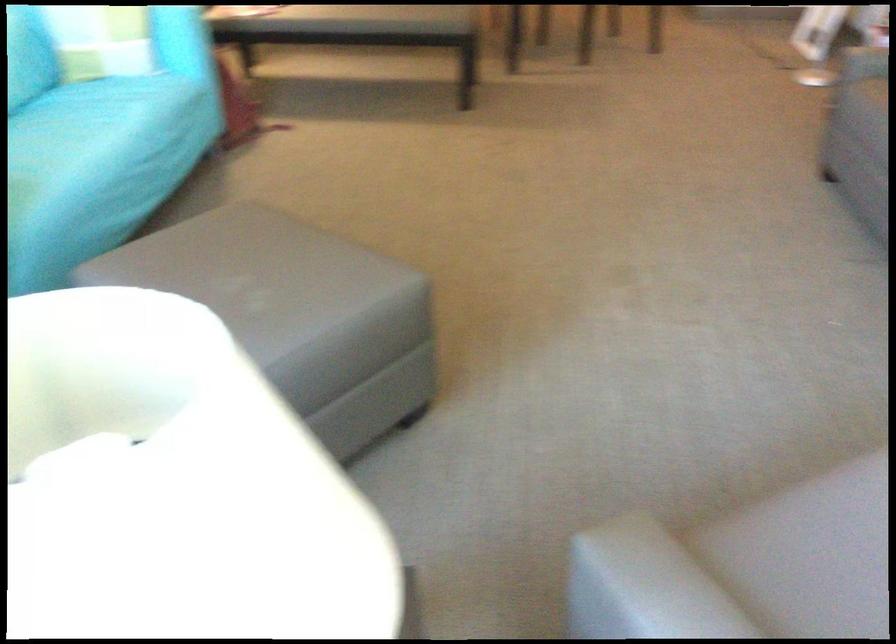
This screenshot has width=896, height=644. Describe the element at coordinates (282, 296) in the screenshot. I see `the gray ottoman` at that location.